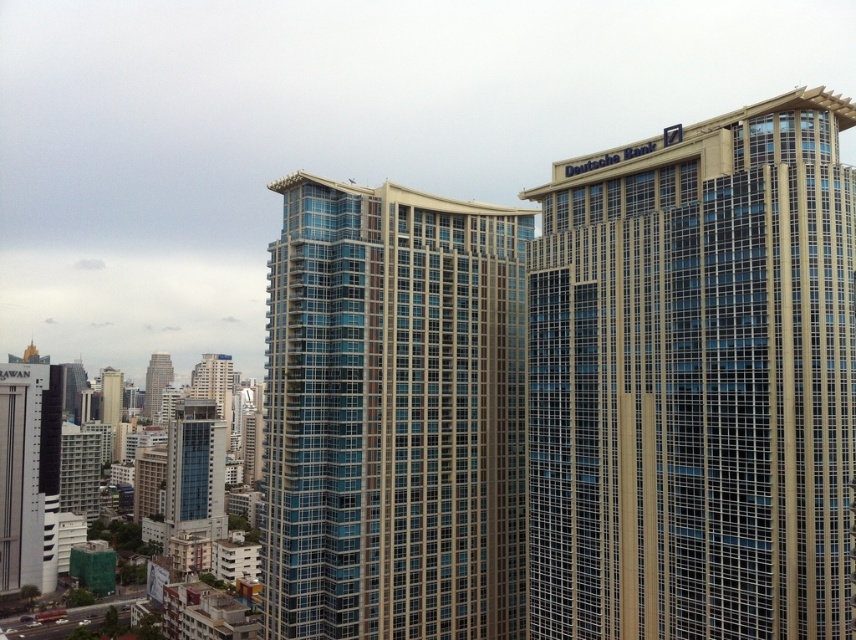
Which is in front, point (210, 467) or point (113, 390)?

Point (210, 467) is more forward.

Which of these two, glassy blue skyscraper at center-left or matte glass building at left, stands shorter?

With less height is matte glass building at left.

Where is `glassy blue skyscraper at center-left`? The height and width of the screenshot is (640, 856). glassy blue skyscraper at center-left is located at coordinates (195, 468).

Can you confirm if white glossy building at lower left is wider than glassy blue skyscraper at center-left?

In fact, white glossy building at lower left might be narrower than glassy blue skyscraper at center-left.

Where is `white glossy building at lower left`? The image size is (856, 640). white glossy building at lower left is located at coordinates (28, 474).

Locate an element on the screen. white glossy building at lower left is located at coordinates (28, 474).

Who is taller, glassy blue building at center or blue glass building at center?

Standing taller between the two is glassy blue building at center.

Between point (443, 316) and point (152, 369), which one is positioned behind?

The point (152, 369) is more distant.

Where is `glassy blue building at center`? The image size is (856, 640). glassy blue building at center is located at coordinates (394, 416).